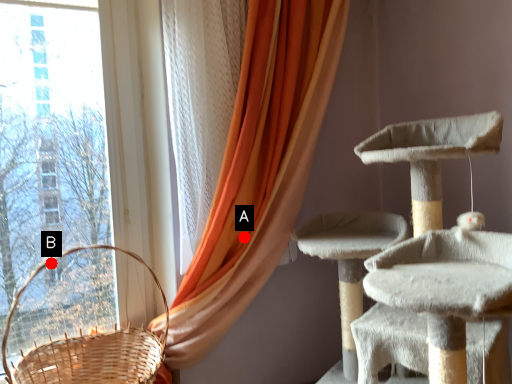
Question: Two points are circled on the image, labeled by A and B beside each circle. Which of the following is the closest to the observer?

Choices:
 (A) A is closer
 (B) B is closer

Answer: (A)